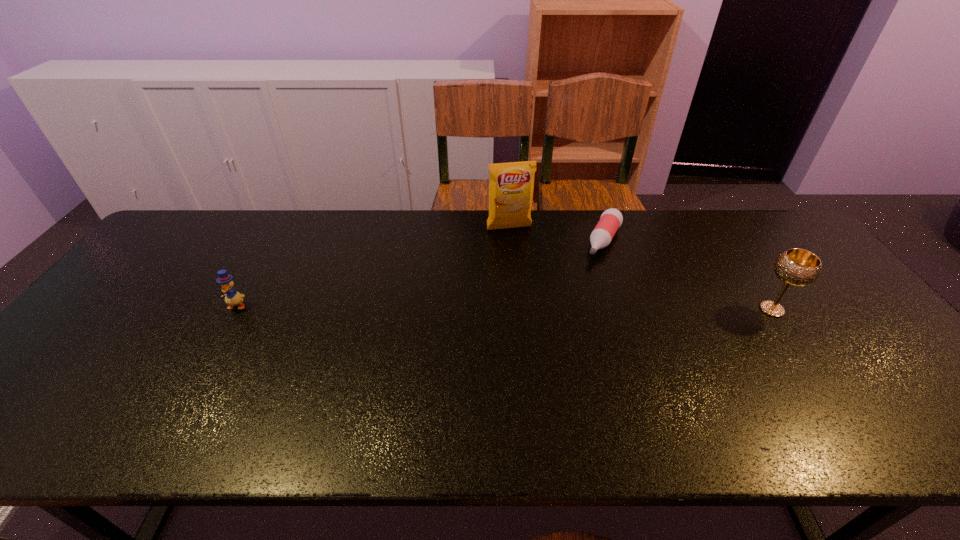
Where is `the second shortest object`? the second shortest object is located at coordinates (232, 298).

Where is `duckling`? duckling is located at coordinates (232, 298).

Where is `the third shortest object`? Image resolution: width=960 pixels, height=540 pixels. the third shortest object is located at coordinates (797, 267).

Find the location of a particular element. The width and height of the screenshot is (960, 540). chalice is located at coordinates (797, 267).

Where is `the third object from right to left`? Image resolution: width=960 pixels, height=540 pixels. the third object from right to left is located at coordinates (511, 185).

Find the location of a particular element. Image resolution: width=960 pixels, height=540 pixels. the tallest object is located at coordinates (511, 185).

This screenshot has width=960, height=540. I want to click on the third object from left to right, so click(611, 219).

Where is `bottle`? Image resolution: width=960 pixels, height=540 pixels. bottle is located at coordinates (611, 219).

Where is `vacant space situated 0.070m on the face of the duckling, where the monocle is placed`? vacant space situated 0.070m on the face of the duckling, where the monocle is placed is located at coordinates pos(222,332).

Image resolution: width=960 pixels, height=540 pixels. Find the location of `vacant space located 0.240m on the left of the third shortest object`. vacant space located 0.240m on the left of the third shortest object is located at coordinates (665, 309).